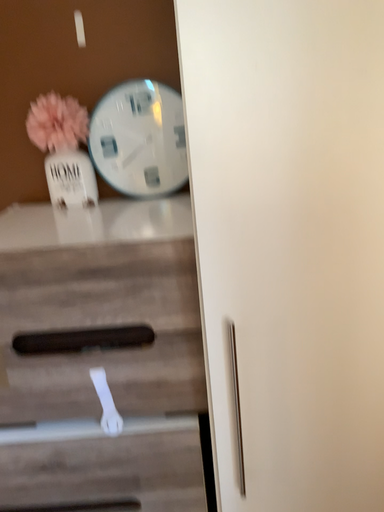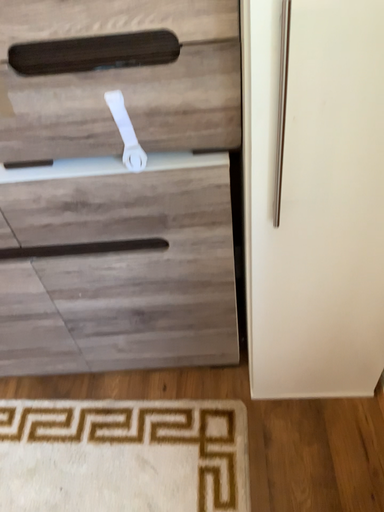
Question: How did the camera likely rotate when shooting the video?

Choices:
 (A) rotated downward
 (B) rotated upward

Answer: (A)